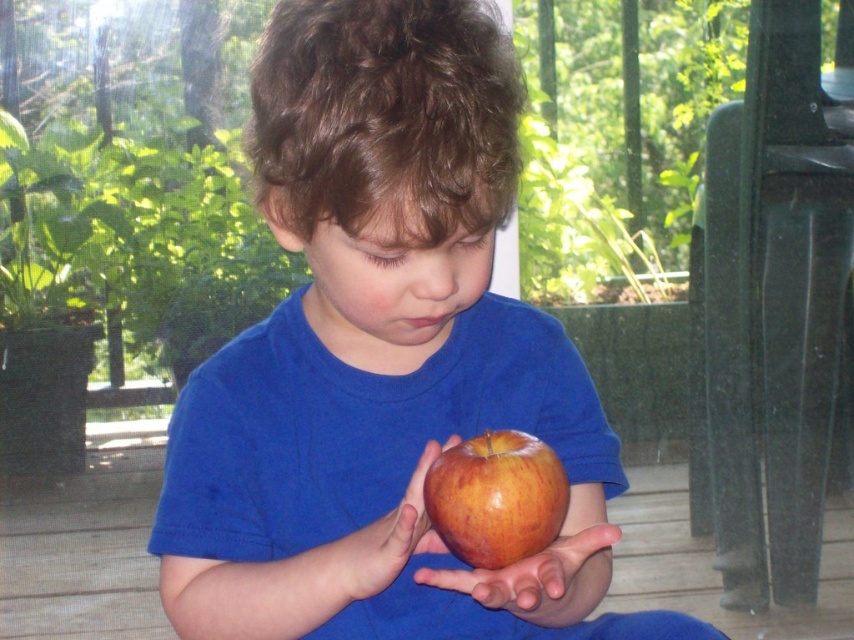
The image size is (854, 640). What do you see at coordinates (496, 497) in the screenshot?
I see `shiny red apple at center` at bounding box center [496, 497].

Who is higher up, shiny red apple at center or glossy apple at center?

shiny red apple at center is higher up.

Is point (490, 544) farther from viewer compared to point (278, 576)?

No, it is not.

The width and height of the screenshot is (854, 640). I want to click on shiny red apple at center, so click(496, 497).

Does matte red apple at center appear on the left side of smooth skin palm at center?

Indeed, matte red apple at center is positioned on the left side of smooth skin palm at center.

In the scene shown: Is matte red apple at center taller than smooth skin palm at center?

Yes, matte red apple at center is taller than smooth skin palm at center.

Who is more forward, (480, 602) or (478, 592)?

Point (478, 592)

Find the location of `matte red apple at center`. matte red apple at center is located at coordinates (382, 358).

Looking at this image, who is positioned more to the left, matte red apple at center or shiny red apple at center?

Positioned to the left is matte red apple at center.

Is the position of matte red apple at center less distant than that of shiny red apple at center?

Yes, matte red apple at center is in front of shiny red apple at center.

Is point (369, 278) farther from camera compared to point (562, 496)?

No.

You are a GUI agent. You are given a task and a screenshot of the screen. Output one action in this format:
    pyautogui.click(x=<x>, y=<y>)
    Task: Click on the matte red apple at center
    Image resolution: width=854 pixels, height=640 pixels.
    Given the screenshot: What is the action you would take?
    pyautogui.click(x=382, y=358)